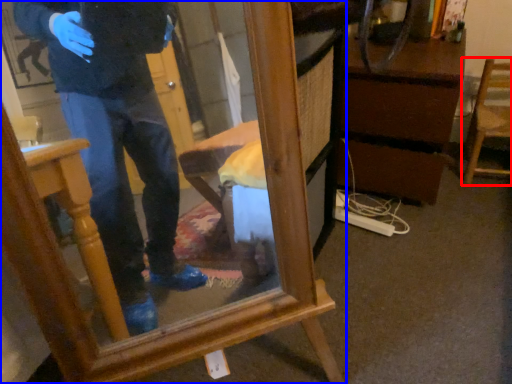
Question: Which object appears farthest to the camera in this image, chair (highlighted by a red box) or furniture (highlighted by a blue box)?

Choices:
 (A) chair
 (B) furniture

Answer: (A)